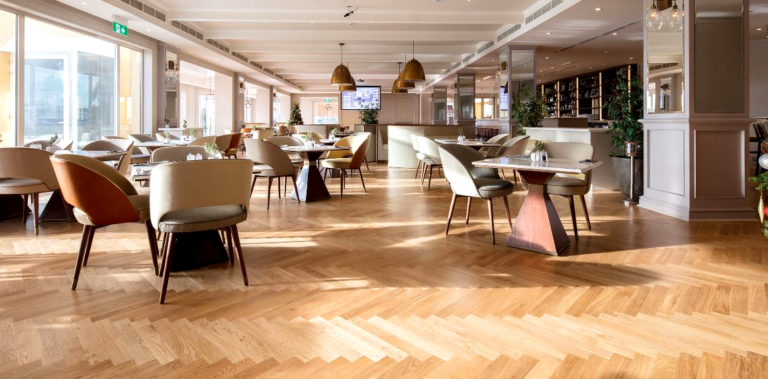
Where is `hanging lamps`? This screenshot has width=768, height=379. hanging lamps is located at coordinates (414, 73), (402, 84), (394, 90), (336, 77), (351, 87).